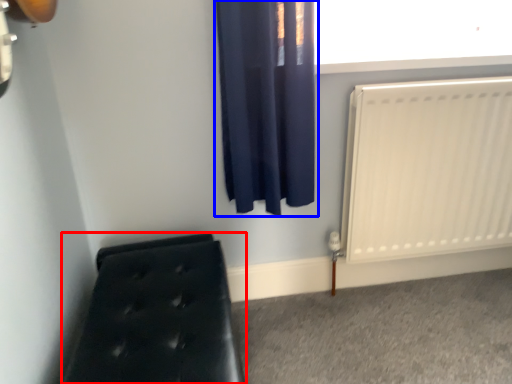
Question: Which object appears farthest to the camera in this image, furniture (highlighted by a red box) or curtain (highlighted by a blue box)?

Choices:
 (A) furniture
 (B) curtain

Answer: (B)